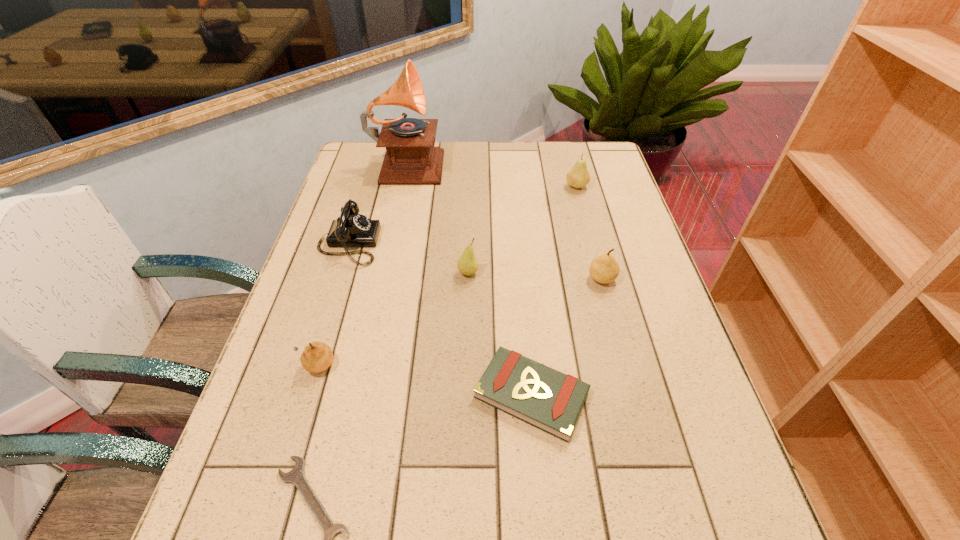
At what (x,y) coordinates should I click in order to perform the action: click on pear that stands as the second closest to the telephone. Please return your answer as a coordinate pair (x, y). The height and width of the screenshot is (540, 960). Looking at the image, I should click on (317, 356).

Where is `free space that satisfies the following two spatial constraints: 1. on the dial of the telephone; 2. on the right side of the leftmost pear`? The image size is (960, 540). free space that satisfies the following two spatial constraints: 1. on the dial of the telephone; 2. on the right side of the leftmost pear is located at coordinates (311, 366).

Locate an element on the screen. vacant space that satisfies the following two spatial constraints: 1. on the back side of the book; 2. on the dial of the telephone is located at coordinates (517, 244).

This screenshot has height=540, width=960. Find the location of `vacant area that satisfies the following two spatial constraints: 1. on the horn of the third pear from right to left; 2. on the right side of the phonograph record`. vacant area that satisfies the following two spatial constraints: 1. on the horn of the third pear from right to left; 2. on the right side of the phonograph record is located at coordinates (384, 273).

Locate an element on the screen. Image resolution: width=960 pixels, height=540 pixels. vacant area in the image that satisfies the following two spatial constraints: 1. on the front side of the second shortest object; 2. on the left side of the sixth tallest object is located at coordinates (306, 395).